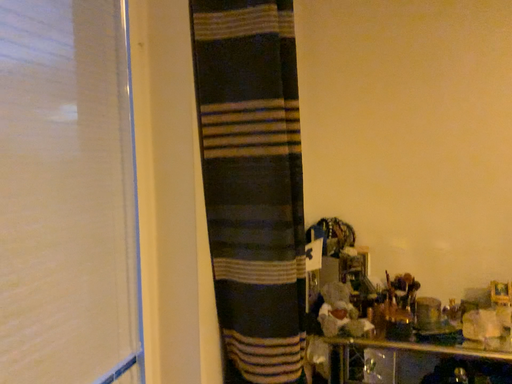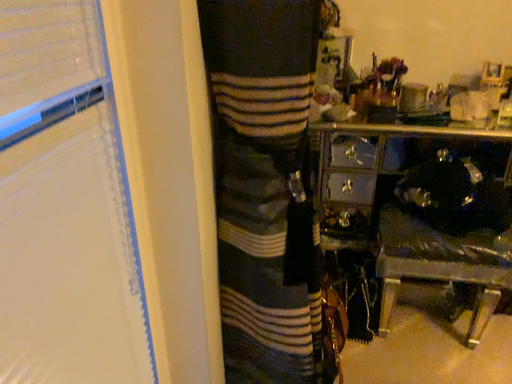
Question: Which way did the camera rotate in the video?

Choices:
 (A) rotated right
 (B) rotated left

Answer: (A)